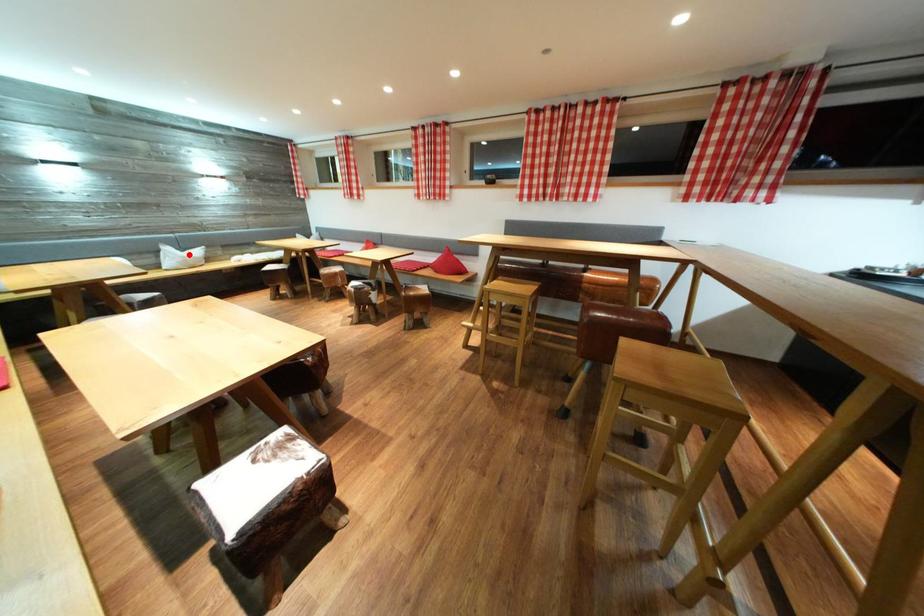
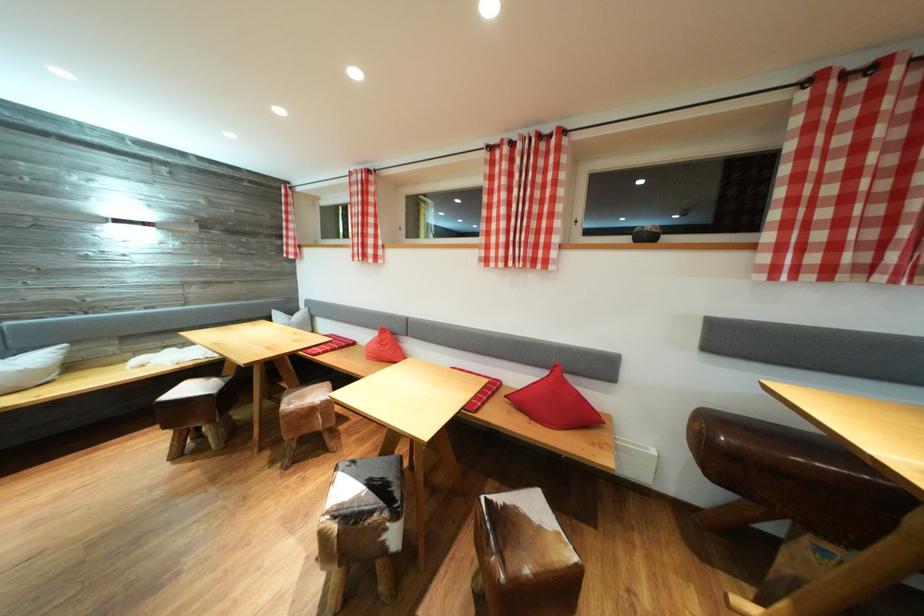
Question: I am providing you with two images of the same scene from different viewpoints. A red point is marked on the first image. Is the red point's position out of view in image 2?

Choices:
 (A) Yes
 (B) No

Answer: (B)